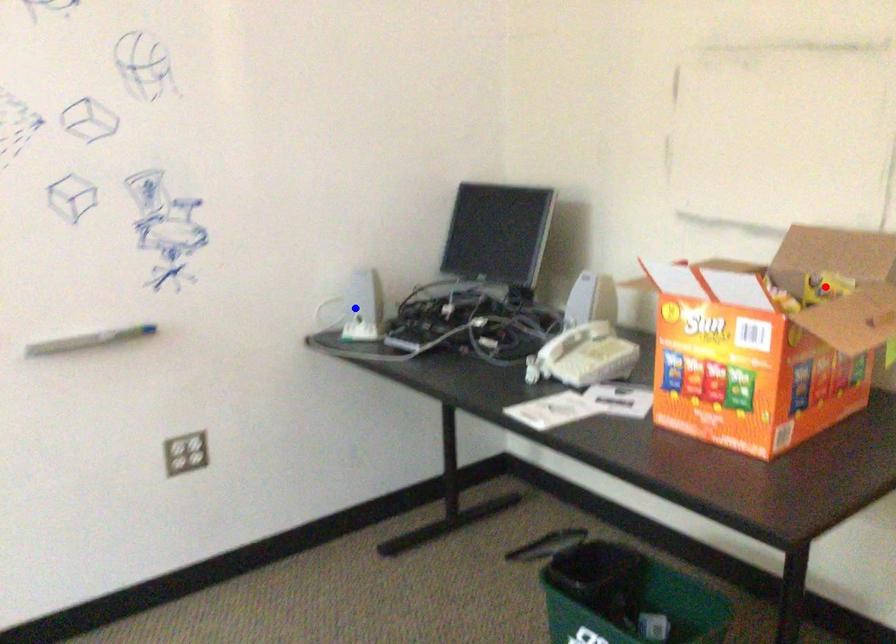
Question: In the image, two points are highlighted. Which point is nearer to the camera? Reply with the corresponding letter.

Choices:
 (A) blue point
 (B) red point

Answer: (B)